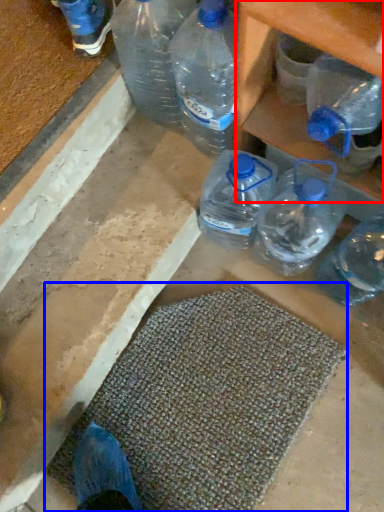
Question: Which point is further to the camera, shelf (highlighted by a red box) or bath mat (highlighted by a blue box)?

Choices:
 (A) shelf
 (B) bath mat

Answer: (B)